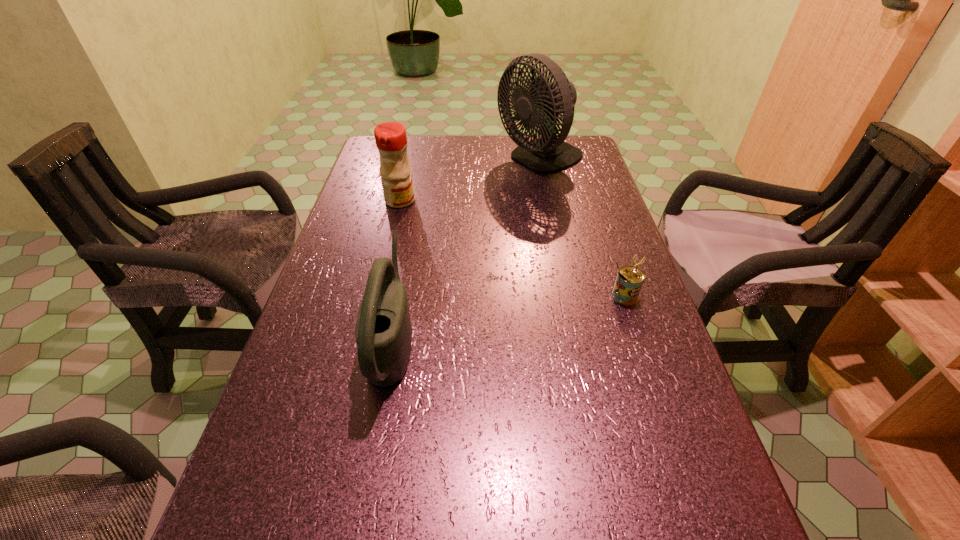
Find the location of a particular element. vacant space located 0.070m on the left of the can is located at coordinates (578, 296).

This screenshot has height=540, width=960. In order to click on object that is at the far edge in this screenshot , I will do `click(541, 107)`.

Identify the location of condiment that is at the left edge. This screenshot has width=960, height=540. 391,140.

Find the location of a particular element. watering can located in the left edge section of the desktop is located at coordinates (383, 330).

Locate an element on the screen. fan at the right edge is located at coordinates (541, 107).

You are a GUI agent. You are given a task and a screenshot of the screen. Output one action in this format:
    pyautogui.click(x=<x>, y=<y>)
    Task: Click on the can at the right edge
    The height and width of the screenshot is (540, 960).
    Given the screenshot: What is the action you would take?
    pyautogui.click(x=629, y=280)

Where is `object that is at the far right corner`? object that is at the far right corner is located at coordinates 541,107.

In the image, there is a desktop. Identify the location of vacant space at the far edge. This screenshot has width=960, height=540. (492, 150).

The height and width of the screenshot is (540, 960). In the image, there is a desktop. In order to click on vacant space at the left edge in this screenshot , I will do `click(339, 393)`.

Where is `free region at the right edge`? The width and height of the screenshot is (960, 540). free region at the right edge is located at coordinates (597, 169).